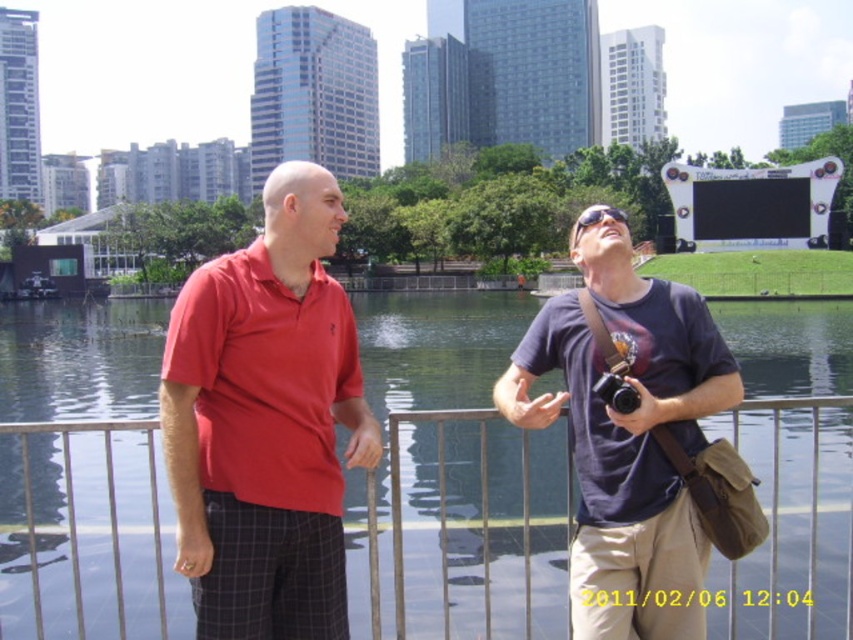
Question: Which point is farther to the camera?

Choices:
 (A) dark blue t-shirt at center
 (B) metallic silver fence at lower center
 (C) black plastic camera at center
 (D) matte red polo shirt at left

Answer: (B)

Question: Does matte red polo shirt at left have a larger size compared to black plastic camera at center?

Choices:
 (A) yes
 (B) no

Answer: (A)

Question: Which object is the closest to the dark blue t-shirt at center?

Choices:
 (A) metallic silver fence at lower center
 (B) red cotton shirt at center
 (C) matte red polo shirt at left

Answer: (B)

Question: Does metallic silver fence at lower center come behind dark blue t-shirt at center?

Choices:
 (A) yes
 (B) no

Answer: (A)

Question: Is matte red polo shirt at left below black plastic camera at center?

Choices:
 (A) no
 (B) yes

Answer: (A)

Question: Which of the following is the farthest from the observer?

Choices:
 (A) (540, 618)
 (B) (311, 182)

Answer: (A)